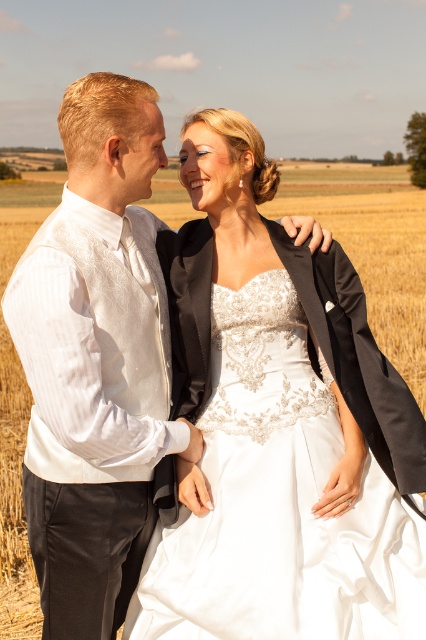
From the picture: Does white textured vest at left have a lesser height compared to satin/embroidered dress at center?

No.

Which of these two, white textured vest at left or satin/embroidered dress at center, stands shorter?

satin/embroidered dress at center is shorter.

This screenshot has width=426, height=640. I want to click on white textured vest at left, so click(95, 360).